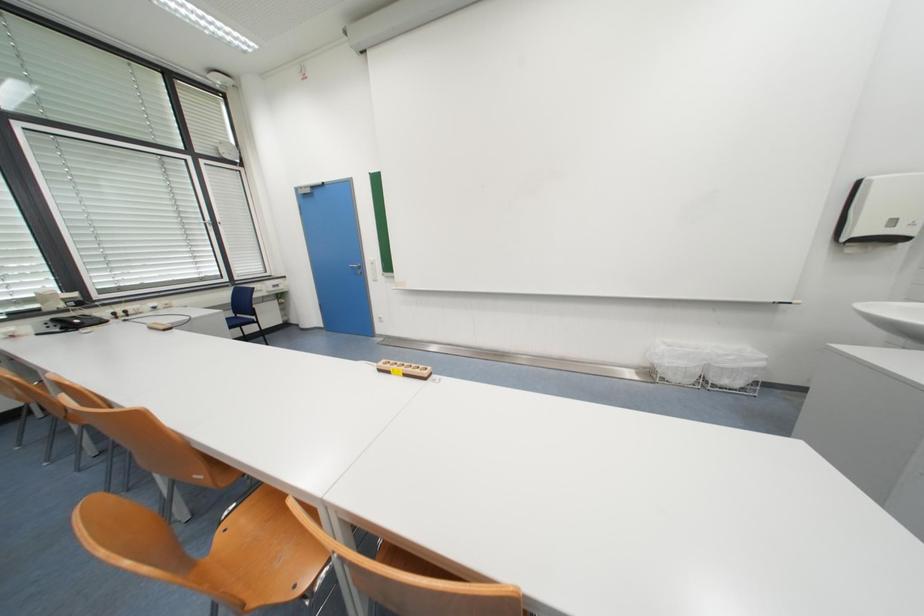
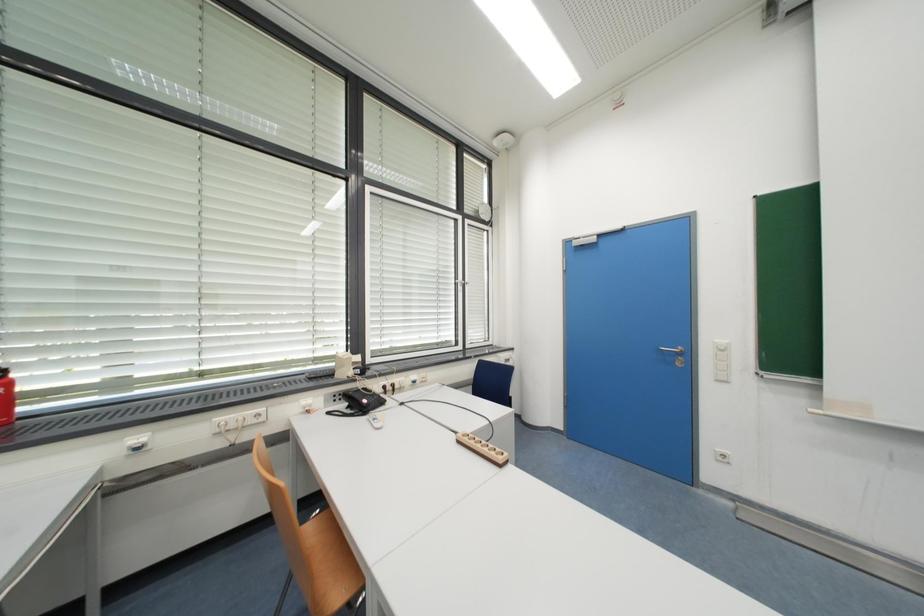
What movement of the cameraman would produce the second image?

The cameraman moved toward left, forward.